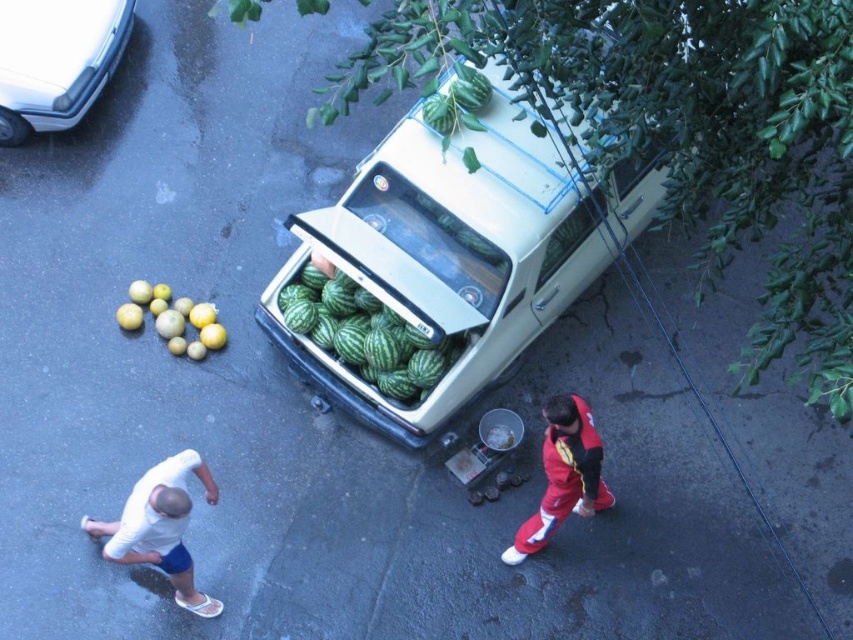
Question: Estimate the real-world distances between objects in this image. Which object is closer to the red fabric jacket at lower right?

Choices:
 (A) yellow matte citrus at left
 (B) white fabric shorts at lower left
 (C) green matte watermelon at center

Answer: (C)

Question: Which point is farther to the camera?

Choices:
 (A) green matte watermelon at center
 (B) red fabric jacket at lower right
 (C) yellow matte citrus at left

Answer: (C)

Question: From the image, what is the correct spatial relationship of white glossy car at upper left in relation to green rind watermelon at center?

Choices:
 (A) above
 (B) below

Answer: (A)

Question: Which point is farther to the camera?

Choices:
 (A) green rind watermelon at center
 (B) white glossy car at upper left
 (C) white fabric shorts at lower left

Answer: (B)

Question: Can you confirm if green rind watermelon at center is wider than red fabric jacket at lower right?

Choices:
 (A) yes
 (B) no

Answer: (A)

Question: From the image, what is the correct spatial relationship of green rind watermelon at center in relation to white fabric shorts at lower left?

Choices:
 (A) below
 (B) above

Answer: (B)